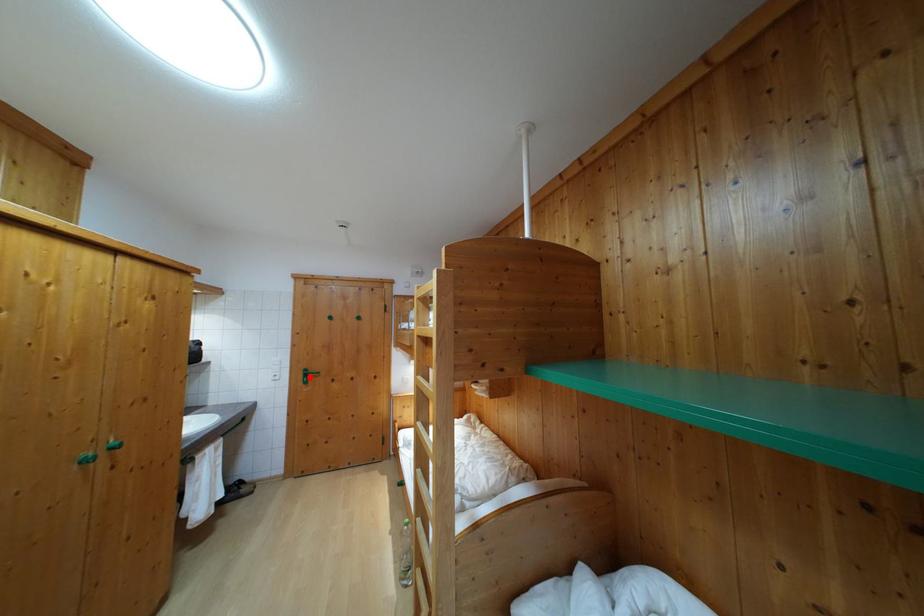
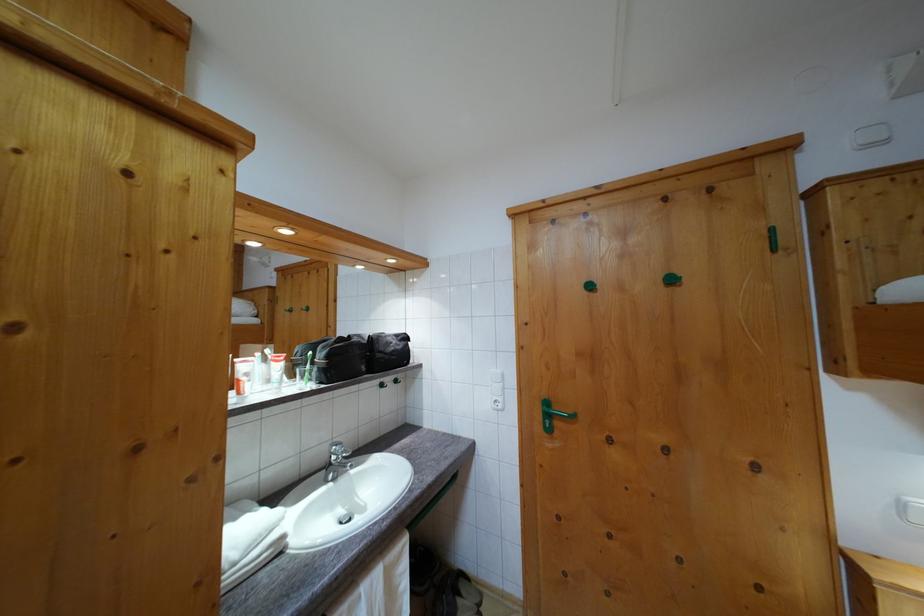
Question: A red point is marked in image1. In image2, is the corresponding 3D point closer to the camera or farther? Reply with the corresponding letter.

Choices:
 (A) The corresponding 3D point is closer.
 (B) The corresponding 3D point is farther.

Answer: (A)